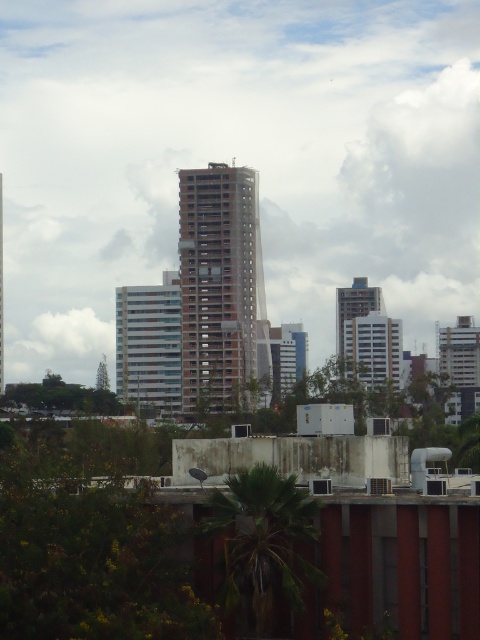
You are a city planner analyzing the urban layout. Given the scene described, which building occupies more horizontal space in the image? The brown concrete building at center or the white glossy building at center?

The brown concrete building at center might be wider than white glossy building at center, so it likely occupies more horizontal space in the image.

Based on the coordinates provided, which object in the scene corresponds to the point with coordinates (149, 346)?

The point with coordinates (149, 346) corresponds to the white glossy building at center.

You are standing in the middle of the urban skyline scene. You see a white glossy building at center and a matte gray building at center. Which building is positioned to the left?

The white glossy building at center is to the left of the matte gray building at center.